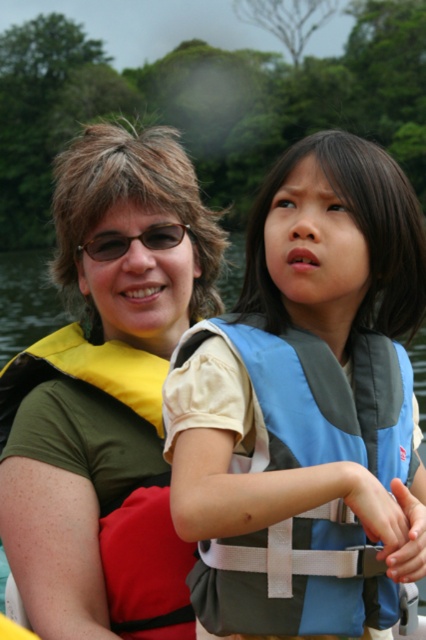
Does blue fabric life vest at center have a lesser height compared to yellow fabric life vest at left?

Yes, blue fabric life vest at center is shorter than yellow fabric life vest at left.

Which is in front, point (313, 253) or point (101, 328)?

Positioned in front is point (313, 253).

The image size is (426, 640). What are the coordinates of `blue fabric life vest at center` in the screenshot? It's located at (305, 408).

In the scene shown: Is yellow fabric life vest at left further to the viewer compared to matte black glasses at upper center?

No, it is not.

Who is more forward, [31,387] or [101,250]?

Point [101,250] is in front.

At what (x,y) coordinates should I click in order to perform the action: click on yellow fabric life vest at left. Please return your answer as a coordinate pair (x, y). Looking at the image, I should click on (106, 397).

At what (x,y) coordinates should I click in order to perform the action: click on yellow fabric life vest at left. Please return your answer as a coordinate pair (x, y). Looking at the image, I should click on (106, 397).

Which is more to the left, blue fabric life vest at center or matte black glasses at upper center?

matte black glasses at upper center

Between blue fabric life vest at center and matte black glasses at upper center, which one is positioned higher?

matte black glasses at upper center is above.

Locate an element on the screen. The width and height of the screenshot is (426, 640). blue fabric life vest at center is located at coordinates (305, 408).